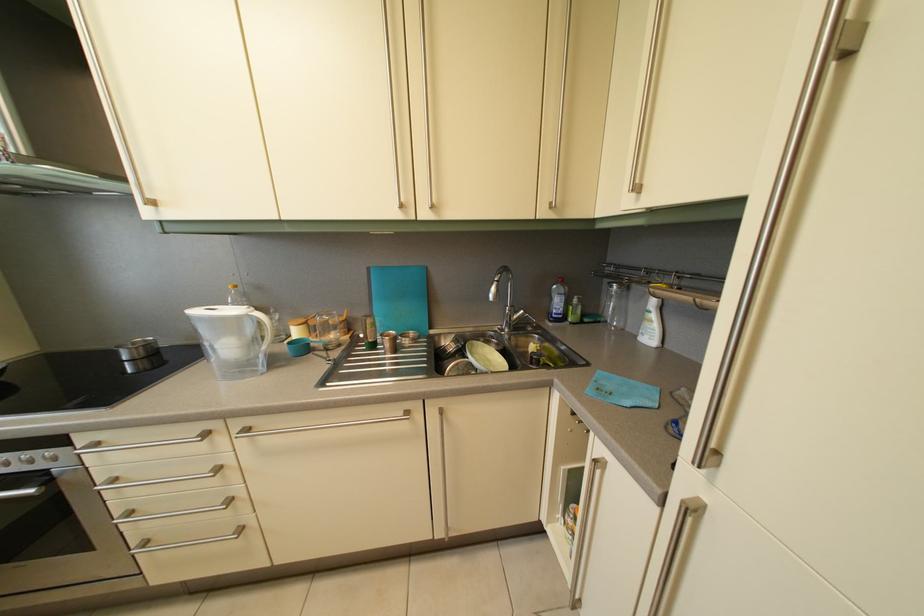
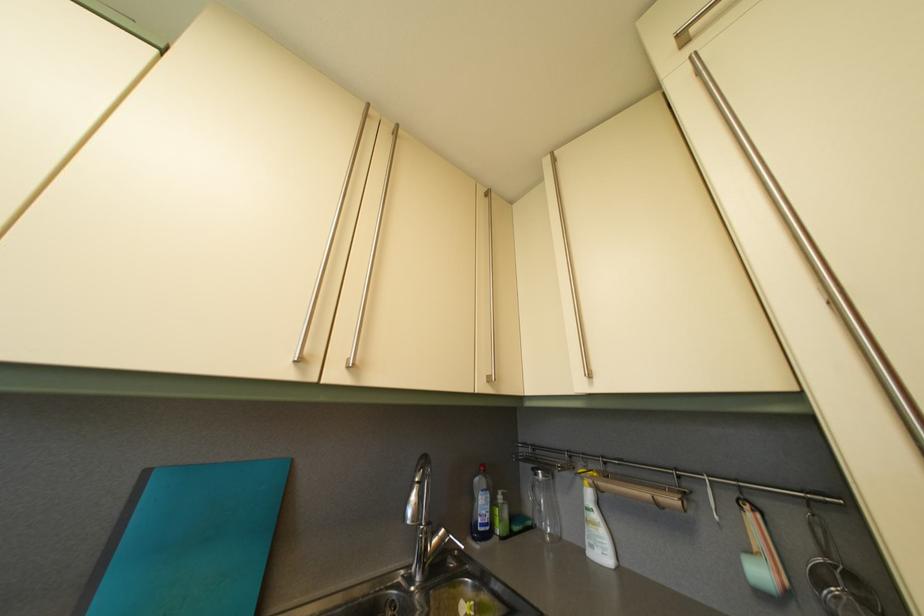
Find the pixel in the second image that matches pixel 619 294 in the first image.

(544, 482)